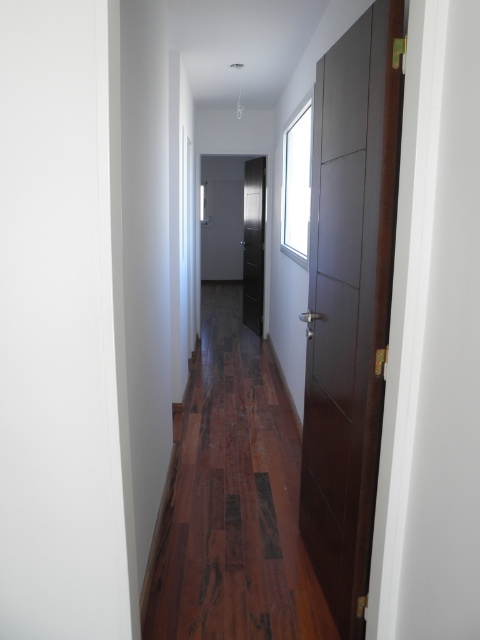
Can you confirm if dark wood floor at center is positioned to the right of dark wood door at center?

No, dark wood floor at center is not to the right of dark wood door at center.

Is point (181, 396) positioned behind point (250, 225)?

No, it is not.

Is point (345, 518) in front of point (255, 291)?

Yes, point (345, 518) is closer to viewer.

Locate an element on the screen. dark wood floor at center is located at coordinates point(358,285).

Which is below, dark wood door at right or brown wood flooring at center?

brown wood flooring at center is lower down.

Is dark wood door at right further to the viewer compared to brown wood flooring at center?

No, dark wood door at right is in front of brown wood flooring at center.

Does point (387, 269) come closer to viewer compared to point (202, 408)?

That is True.

Find the location of `dark wood door at right`. dark wood door at right is located at coordinates (349, 304).

Does dark wood door at right appear on the left side of dark wood door at center?

In fact, dark wood door at right is to the right of dark wood door at center.

Which is in front, point (370, 116) or point (259, 333)?

Point (370, 116) is in front.

This screenshot has height=640, width=480. In order to click on dark wood door at right in this screenshot , I will do `click(349, 304)`.

Find the location of a particular element. dark wood door at right is located at coordinates (349, 304).